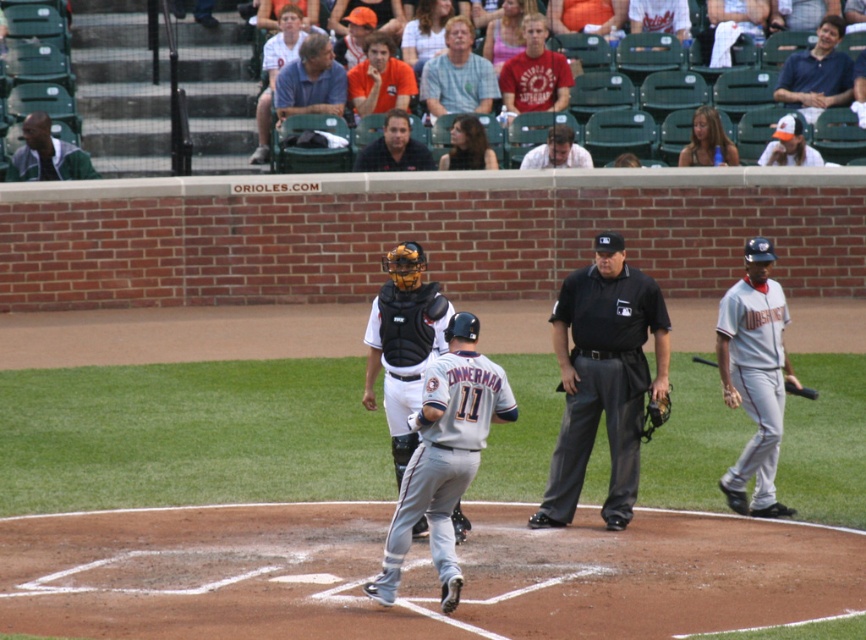
You are a photographer standing at the camera position. You want to capture a closeup shot of the blue shirt at upper center. Given that your camera has a maximum zoom range of 20 meters, can you achieve this without moving closer?

The blue shirt at upper center is 23.92 meters away from the camera. Since the camera can only zoom up to 20 meters, it cannot capture a closeup of the blue shirt at upper center without moving closer.

You are a spectator at the baseball game and want to take a photo of both the blue shirt at upper center and the orange shirt at upper center. Since you can only focus on one at a time, which shirt should you focus on to ensure the other is still in the background?

You should focus on the blue shirt at upper center because it is in front of the orange shirt at upper center, so the orange shirt will be in the background when the blue shirt is in focus.

You are a spectator at the baseball game and notice two items in the image. The first is a blue shirt at upper right, and the second is a matte gray helmet at center. From your viewpoint, which item is positioned more to the right?

The blue shirt at upper right is positioned to the right of the matte gray helmet at center, so the blue shirt at upper right is more to the right.